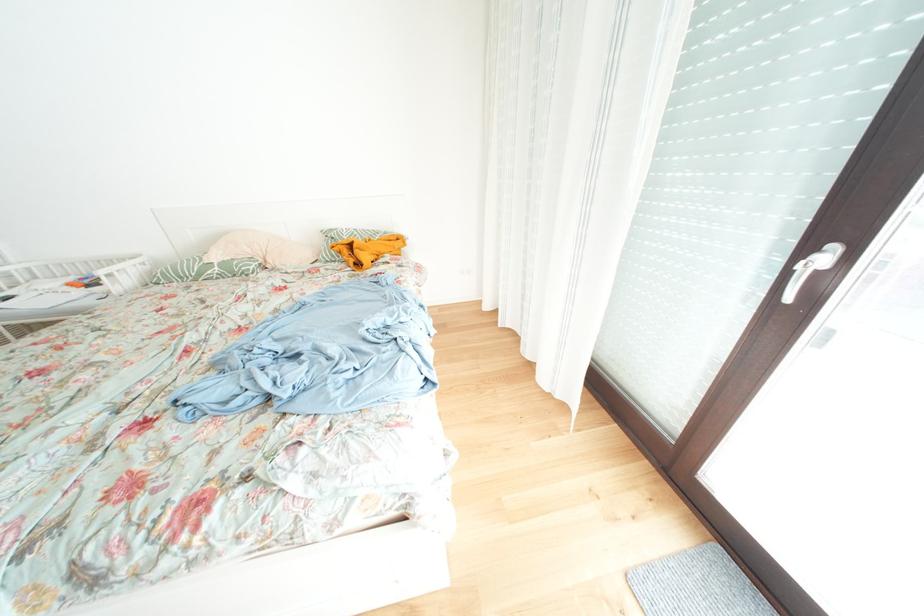
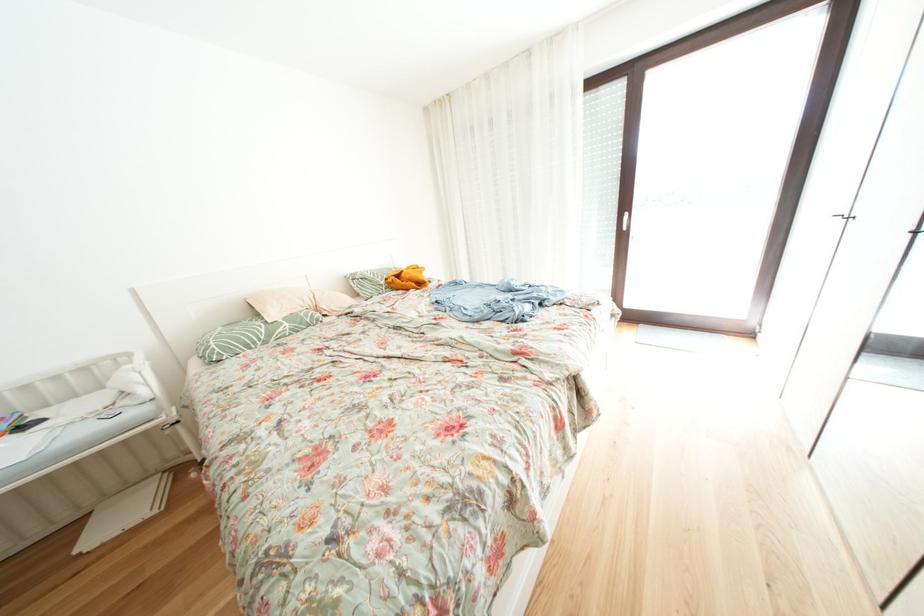
Locate, in the second image, the point that corresponds to (x=225, y=273) in the first image.

(296, 329)